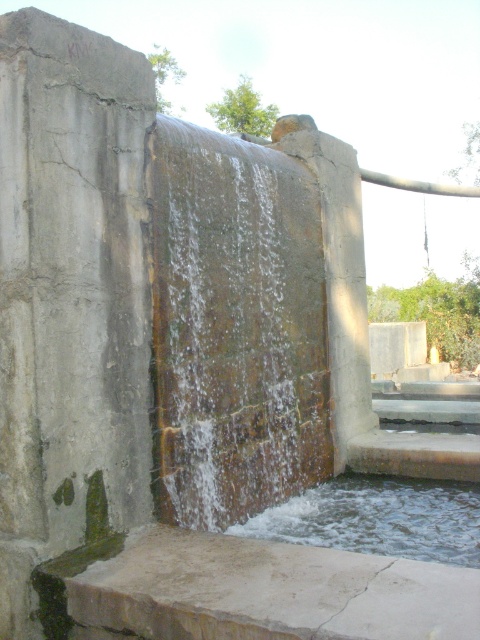
Who is positioned more to the left, smooth concrete slab at lower center or clear water at bottom?

smooth concrete slab at lower center

Can you confirm if smooth concrete slab at lower center is bigger than clear water at bottom?

Indeed, smooth concrete slab at lower center has a larger size compared to clear water at bottom.

Between point (416, 563) and point (303, 536), which one is positioned behind?

Positioned behind is point (303, 536).

The image size is (480, 640). I want to click on smooth concrete slab at lower center, so click(268, 592).